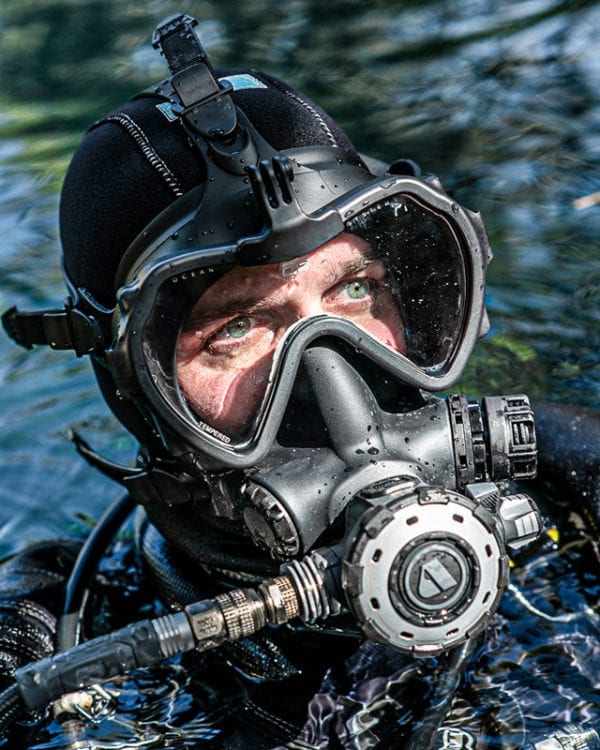
Where is `cable`? The image size is (600, 750). cable is located at coordinates (13, 694).